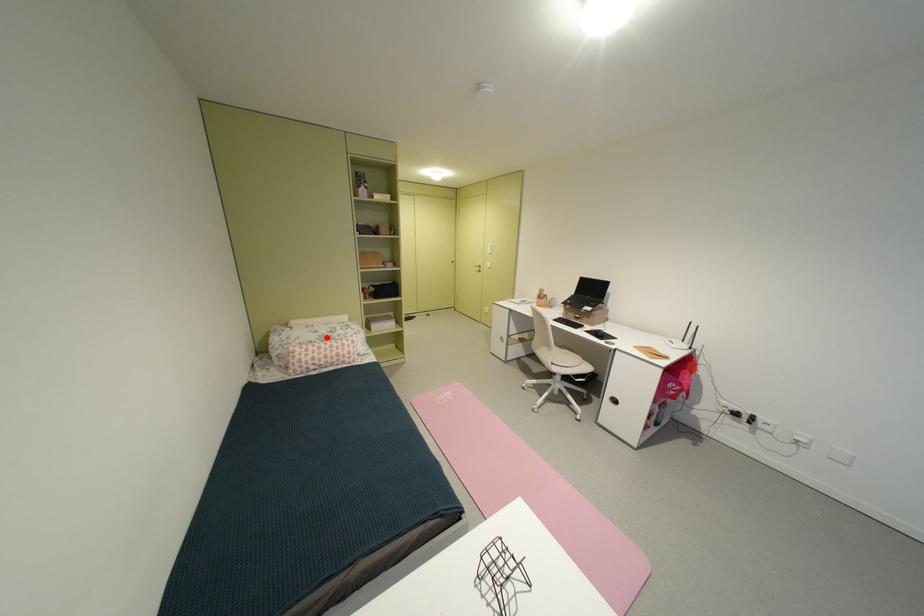
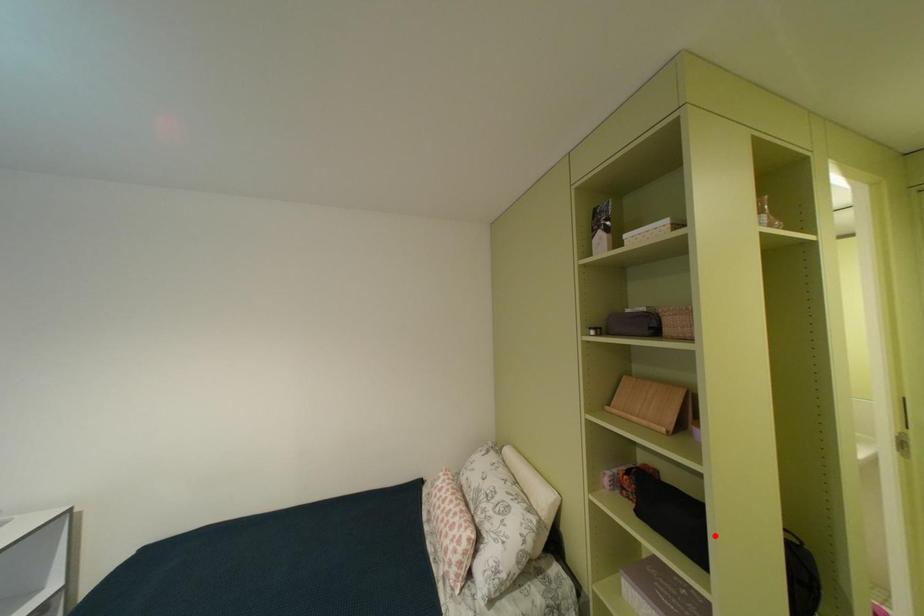
I am providing you with two images of the same scene from different viewpoints. A red point is marked on the first image and another point is marked on the second image. Is the red point in image1 aligned with the point shown in image2?

No